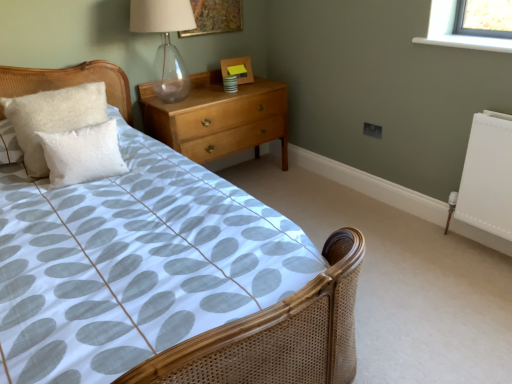
Where is `vacant area that lies to the right of wooden picture frame at upper center, the 2th picture frame viewed from the top`? The image size is (512, 384). vacant area that lies to the right of wooden picture frame at upper center, the 2th picture frame viewed from the top is located at coordinates (264, 82).